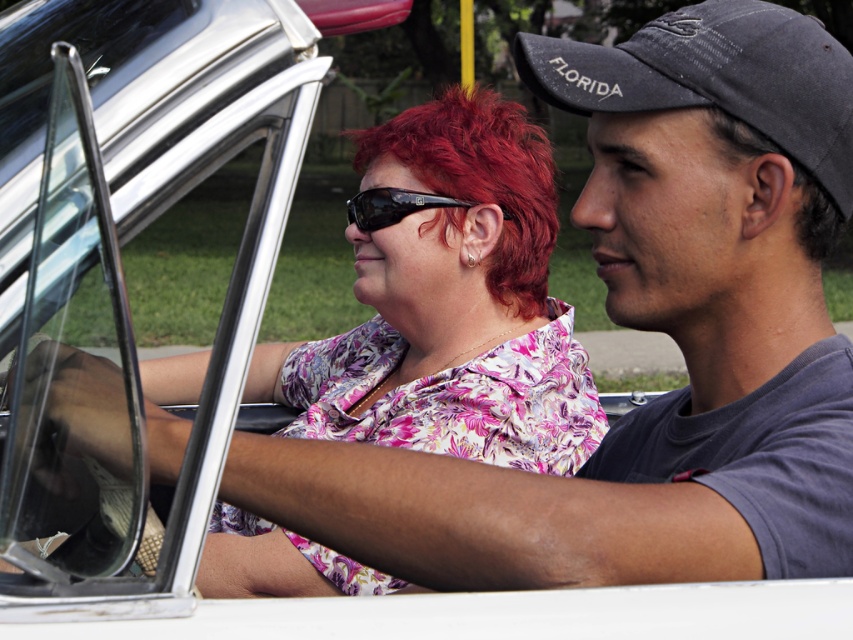
You are a photographer trying to capture a closeup of the vivid red hair at center and the black reflective sunglasses at center. Which object should you focus on first to ensure it appears sharp in the photo?

You should focus on the vivid red hair at center first because it is closer to the viewer than the black reflective sunglasses at center, ensuring it will be in focus before adjusting for the sunglasses.

You are a passenger in the vintage car shown. You notice two points marked on the car. The first point is at coordinates point (x=48, y=246) and the second is at point (x=486, y=97). Which point is closer to the front of the car?

Point (x=48, y=246) is in front of point (x=486, y=97), so the first point is closer to the front of the car.

You are a photographer trying to capture a clear shot of the vivid red hair at center and the black reflective sunglasses at center. Since reflections can be tricky, which object is more likely to cause glare from the sunlight? Explain your reasoning.

The black reflective sunglasses at center are more likely to cause glare because reflective surfaces like sunglasses lenses typically produce stronger reflections compared to hair, which absorbs more light. The vivid red hair at center might not reflect as much light as the sunglasses.